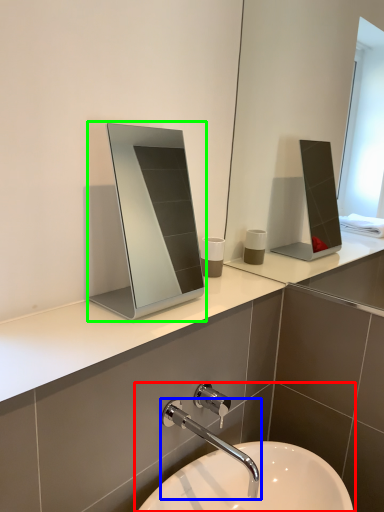
Question: Considering the real-world distances, which object is closest to sink (highlighted by a red box)? tap (highlighted by a blue box) or medicine cabinet (highlighted by a green box).

Choices:
 (A) tap
 (B) medicine cabinet

Answer: (A)